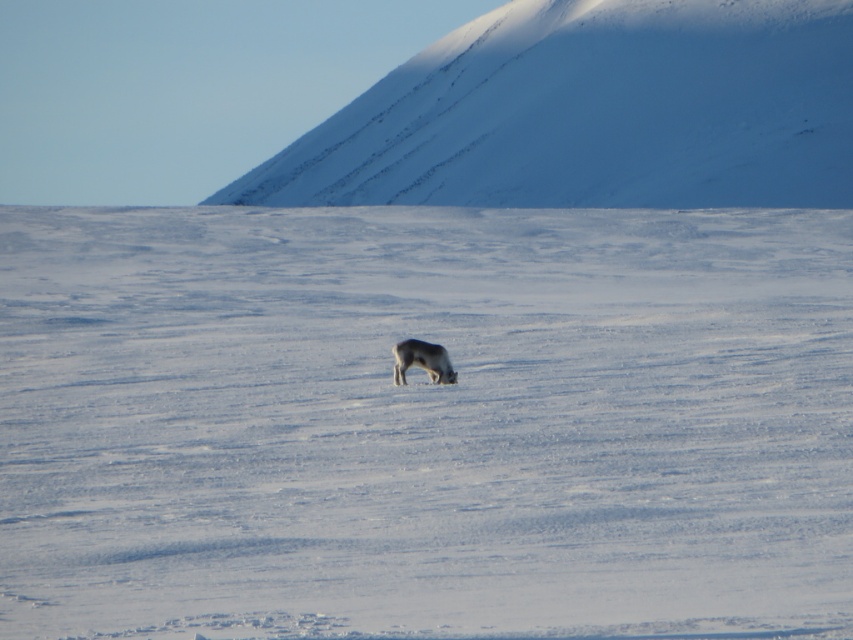
You are an explorer trying to reach the base of the snowy white mountain at upper center. From your current position at the edge of the white fluffy snow at center, which direction should you head to reach the mountain?

The white fluffy snow at center is located below the snowy white mountain at upper center, so you should head upwards or towards the upper direction to reach the base of the snowy white mountain at upper center.

You are standing at the edge of the snow expanse in the image. If you want to reach the snowy white mountain at upper center, which direction should you move relative to your current position?

The snowy white mountain at upper center is located at point (593,113) in the image. Since you are at the edge of the snow expanse in the foreground, you should move towards the upper center direction to reach it.

From the picture: You are standing in the snow and see the point marked at coordinates (265, 246). If you want to walk straight to that point, how far will you have to walk?

The point at coordinates (265, 246) is 53.25 meters away from you, so you will have to walk 53.25 meters to reach it.